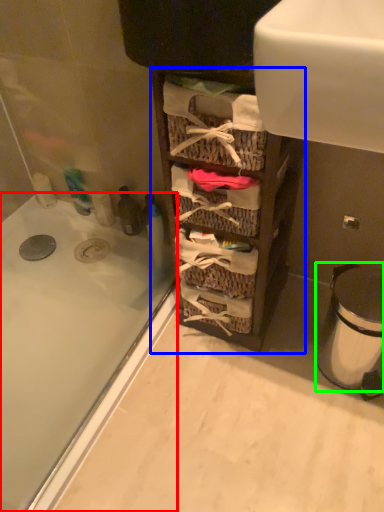
Question: Estimate the real-world distances between objects in this image. Which object is closer to bathtub (highlighted by a red box), cabinetry (highlighted by a blue box) or trash bin/can (highlighted by a green box)?

Choices:
 (A) cabinetry
 (B) trash bin/can

Answer: (A)